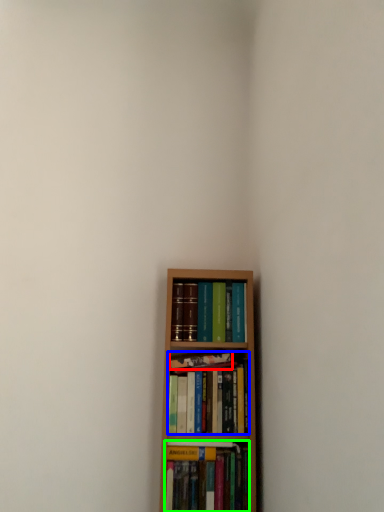
Question: Which object is the farthest from book (highlighted by a red box)? Choose among these: book (highlighted by a blue box) or book (highlighted by a green box).

Choices:
 (A) book
 (B) book

Answer: (B)